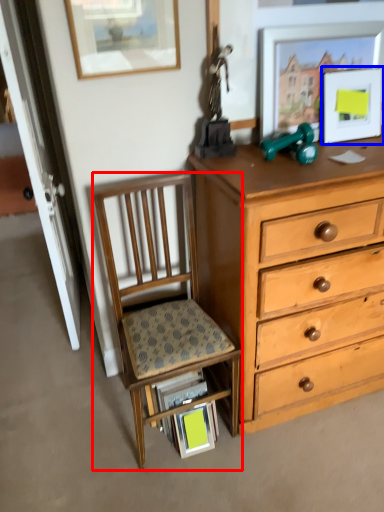
Question: Among these objects, which one is nearest to the camera, chair (highlighted by a red box) or picture frame (highlighted by a blue box)?

Choices:
 (A) chair
 (B) picture frame

Answer: (A)